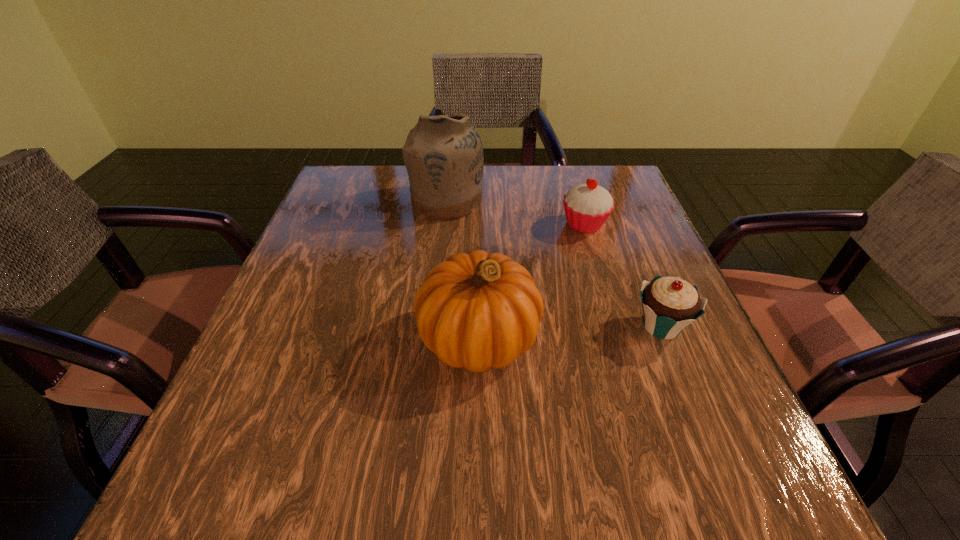
I want to click on free space between the farther cupcake and the nearer cupcake, so click(x=623, y=275).

Find the location of a particular element. vacant space that is in between the farther cupcake and the nearer cupcake is located at coordinates (623, 275).

Where is `vacant area between the farther cupcake and the tallest object`? The width and height of the screenshot is (960, 540). vacant area between the farther cupcake and the tallest object is located at coordinates (516, 212).

Find the location of a particular element. empty space between the nearer cupcake and the farther cupcake is located at coordinates (623, 275).

Locate an element on the screen. The image size is (960, 540). vacant area that lies between the nearer cupcake and the farther cupcake is located at coordinates (623, 275).

Image resolution: width=960 pixels, height=540 pixels. In order to click on free space between the farther cupcake and the nearer cupcake in this screenshot , I will do `click(623, 275)`.

Identify which object is the nearest to the nearer cupcake. Please provide its 2D coordinates. Your answer should be formatted as a tuple, i.e. [(x, y)], where the tuple contains the x and y coordinates of a point satisfying the conditions above.

[(478, 310)]

Identify the location of object that can be found as the second closest to the pottery. The width and height of the screenshot is (960, 540). [478, 310].

Where is `vacant space that satisfies the following two spatial constraints: 1. on the front side of the nearer cupcake; 2. on the right side of the tallest object`? vacant space that satisfies the following two spatial constraints: 1. on the front side of the nearer cupcake; 2. on the right side of the tallest object is located at coordinates (434, 326).

Locate an element on the screen. vacant space that satisfies the following two spatial constraints: 1. on the front side of the pumpkin; 2. on the left side of the tallest object is located at coordinates (433, 338).